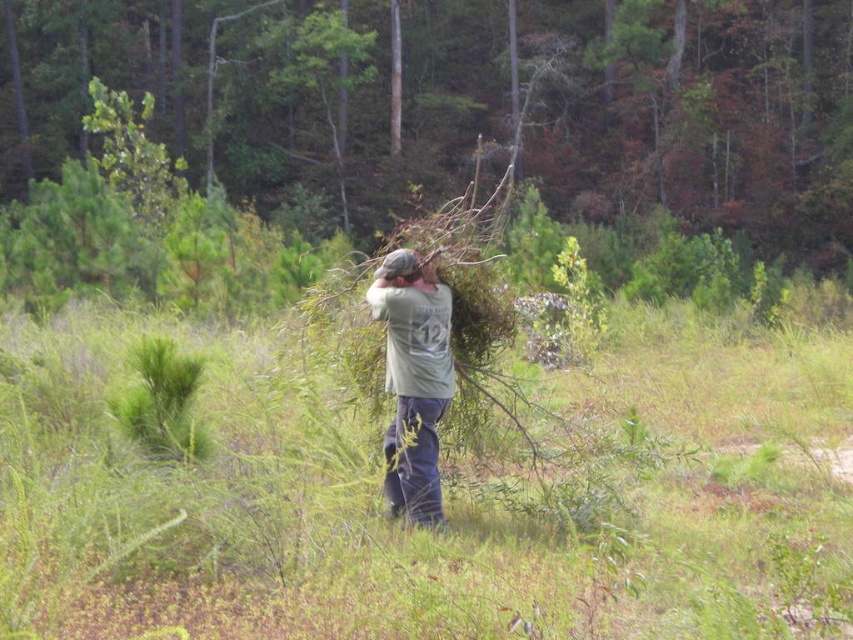
Is green grass at center to the left of gray matte hair at center from the viewer's perspective?

Indeed, green grass at center is positioned on the left side of gray matte hair at center.

Who is more distant from viewer, (502,561) or (376,273)?

The point (376,273) is behind.

You are a GUI agent. You are given a task and a screenshot of the screen. Output one action in this format:
    pyautogui.click(x=<x>, y=<y>)
    Task: Click on the green grass at center
    
    Given the screenshot: What is the action you would take?
    pyautogui.click(x=444, y=496)

Who is shorter, green grass at center or brown textured branches at center?

green grass at center

Who is more forward, (660,472) or (817,250)?

Point (660,472) is in front.

Based on the photo, who is more distant from viewer, (x=631, y=592) or (x=218, y=138)?

The point (x=218, y=138) is more distant.

This screenshot has width=853, height=640. I want to click on green grass at center, so click(444, 496).

Can you confirm if brown textured branches at center is taller than green matte shirt at center?

Indeed, brown textured branches at center has a greater height compared to green matte shirt at center.

Measure the distance from brown textured branches at center to green matte shirt at center.

They are 109.05 feet apart.

Who is more forward, (688, 116) or (445, 292)?

Point (445, 292)

Identify the location of brown textured branches at center. (469, 104).